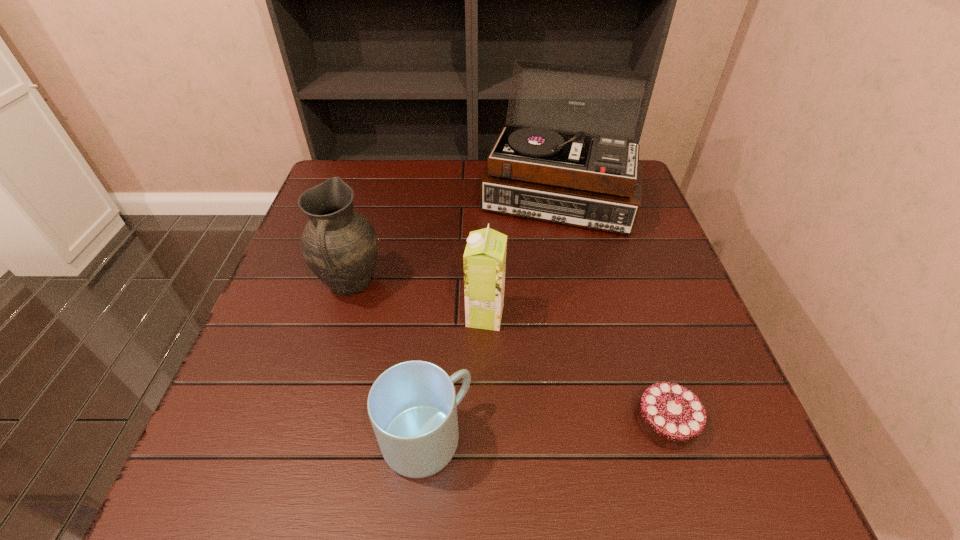
Locate an element on the screen. free spot located 0.260m on the left of the shortest object is located at coordinates (490, 421).

I want to click on object that is at the far edge, so click(x=545, y=165).

Where is `object located in the near edge section of the desktop`? This screenshot has height=540, width=960. object located in the near edge section of the desktop is located at coordinates (412, 406).

Identify the location of object at the left edge. The image size is (960, 540). (340, 246).

This screenshot has width=960, height=540. In order to click on record player that is positioned at the right edge in this screenshot , I will do `click(545, 165)`.

Image resolution: width=960 pixels, height=540 pixels. I want to click on chocolate cake located at the right edge, so click(x=670, y=415).

Locate an element on the screen. This screenshot has width=960, height=540. object located at the far right corner is located at coordinates (545, 165).

At what (x,y) coordinates should I click in order to perform the action: click on vacant space at the far edge of the desktop. Please return your answer as a coordinate pair (x, y). Looking at the image, I should click on (462, 194).

Identify the location of vacant area at the near edge. This screenshot has height=540, width=960. (426, 500).

Locate an element on the screen. The width and height of the screenshot is (960, 540). free space at the left edge of the desktop is located at coordinates (302, 225).